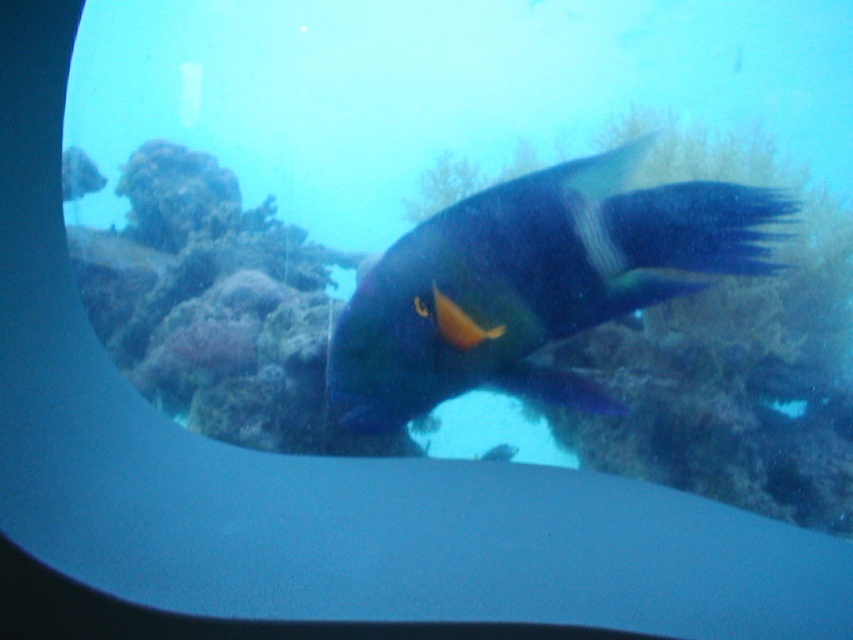
You are an underwater photographer holding a camera with a 6 inch wide lens. You want to capture both the purple coral at center and the shiny blue fish at center in the same frame without moving either the camera or the subjects. Is this possible?

The purple coral at center and shiny blue fish at center are 5.95 inches apart from each other, which is less than the 6 inch width of the lens. Therefore, it is possible to capture both in the same frame without moving anything.

You are an underwater photographer aiming to capture a photo of the purple coral at center and the shiny blue fish at center. Based on their positions, which object should you focus on first to ensure both are in frame?

The purple coral at center is positioned on the left side of shiny blue fish at center, so you should focus on the shiny blue fish at center first to ensure both are in frame.